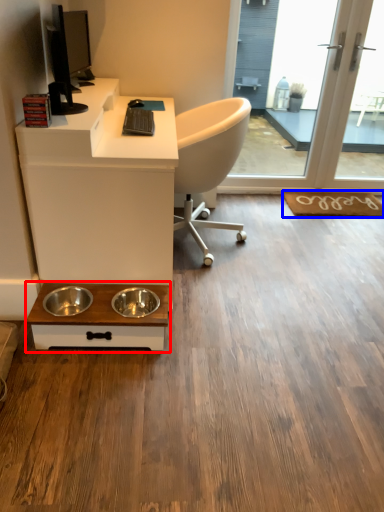
Question: Which of the following is the closest to the observer, table (highlighted by a red box) or doormat (highlighted by a blue box)?

Choices:
 (A) table
 (B) doormat

Answer: (A)